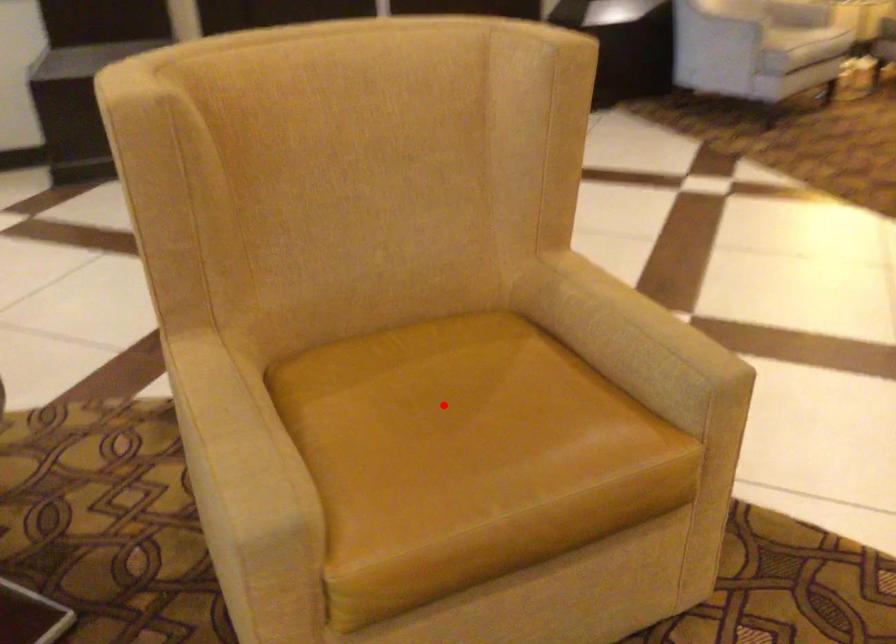
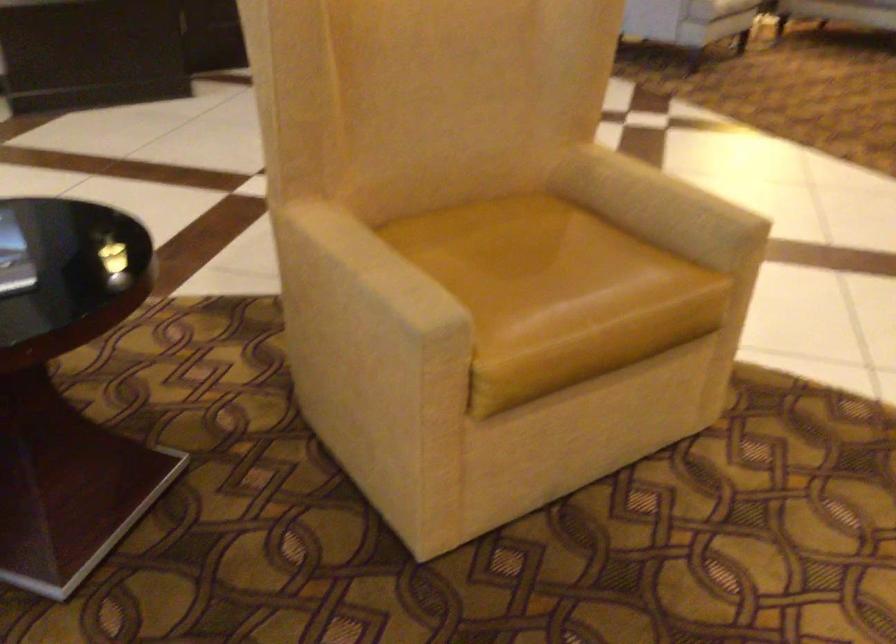
In the second image, find the point that corresponds to the highlighted location in the first image.

(520, 256)